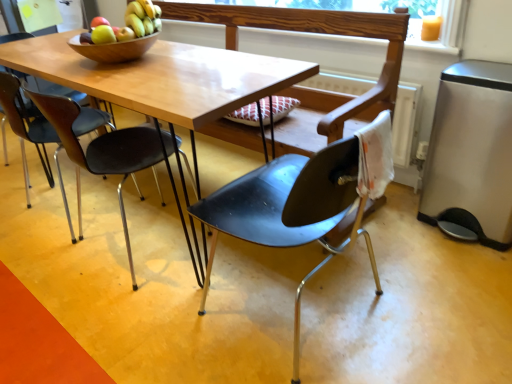
At what (x,y) coordinates should I click in order to perform the action: click on vacant space that is to the left of black plastic chair at left, which appears as the second chair when viewed from the right. Please return your answer as a coordinate pair (x, y). Looking at the image, I should click on (47, 266).